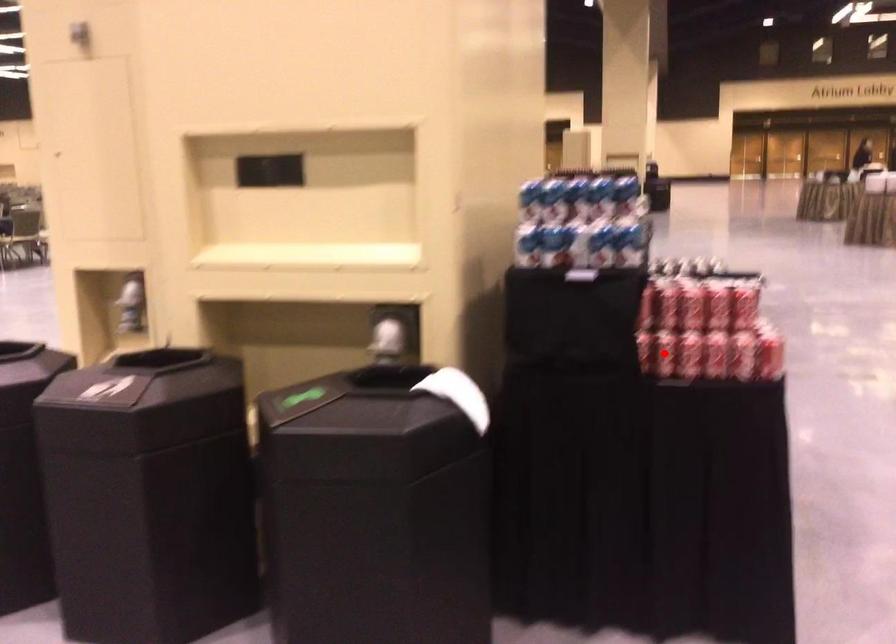
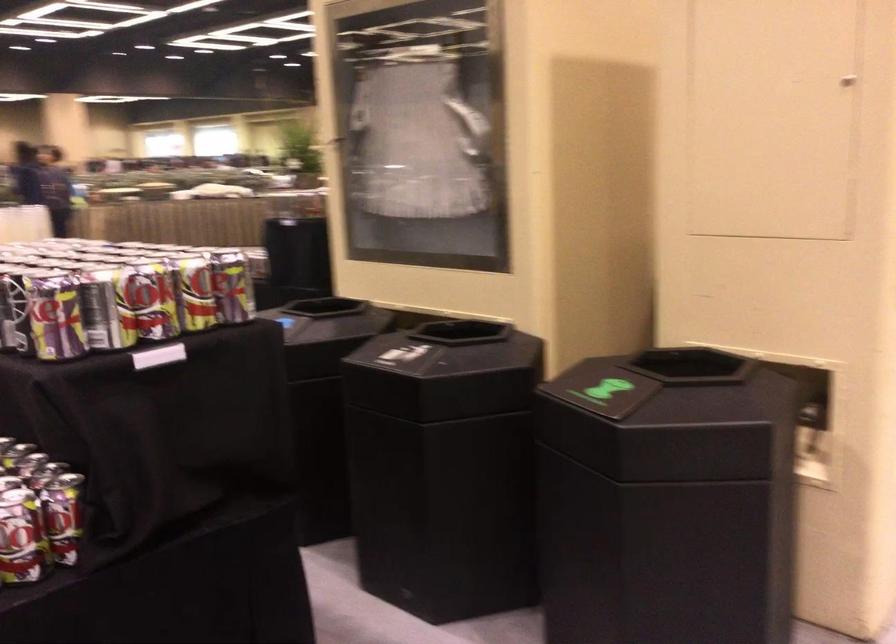
Question: I am providing you with two images of the same scene from different viewpoints. A red point is marked on the first image. Can you still see the location of the red point in image 2?

Choices:
 (A) Yes
 (B) No

Answer: (B)